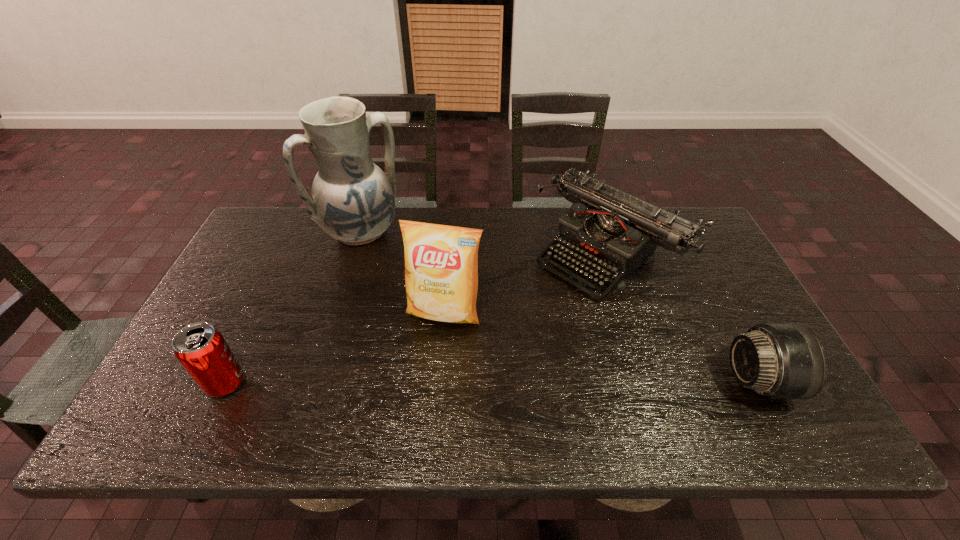
Where is `soda can`? soda can is located at coordinates (201, 349).

The height and width of the screenshot is (540, 960). What are the coordinates of `telephoto lens` in the screenshot? It's located at (776, 360).

Find the location of a particular element. Image resolution: width=960 pixels, height=540 pixels. the tallest object is located at coordinates (353, 200).

Where is `the second object from left to right`? the second object from left to right is located at coordinates (353, 200).

This screenshot has height=540, width=960. I want to click on typewriter, so click(614, 232).

At what (x,y) coordinates should I click in order to perform the action: click on the third object from left to right. Please return your answer as a coordinate pair (x, y). Looking at the image, I should click on (441, 262).

Where is `crisp (potato chip)`? Image resolution: width=960 pixels, height=540 pixels. crisp (potato chip) is located at coordinates (441, 262).

Identify the location of free point located on the right of the leftmost object. This screenshot has width=960, height=540. (284, 383).

Where is `vacant space located on the front-facing side of the second object from left to right`? vacant space located on the front-facing side of the second object from left to right is located at coordinates (427, 307).

In order to click on free space located on the front-facing side of the second object from left to right in this screenshot , I will do (390, 263).